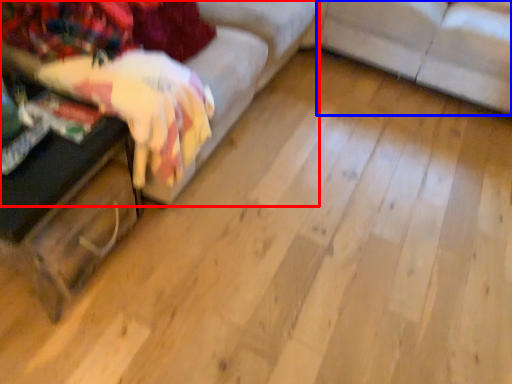
Question: Among these objects, which one is nearest to the camera, studio couch (highlighted by a red box) or studio couch (highlighted by a blue box)?

Choices:
 (A) studio couch
 (B) studio couch

Answer: (A)